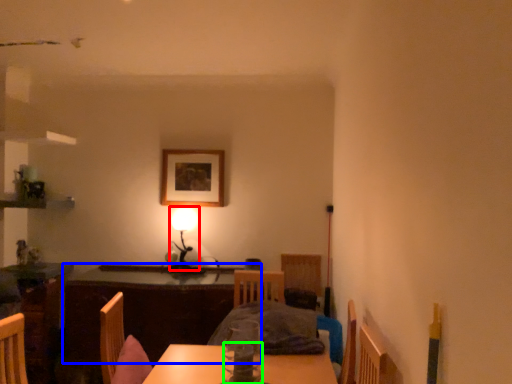
Question: Considering the real-world distances, which object is farthest from table lamp (highlighted by a red box)? table (highlighted by a blue box) or tableware (highlighted by a green box)?

Choices:
 (A) table
 (B) tableware

Answer: (B)